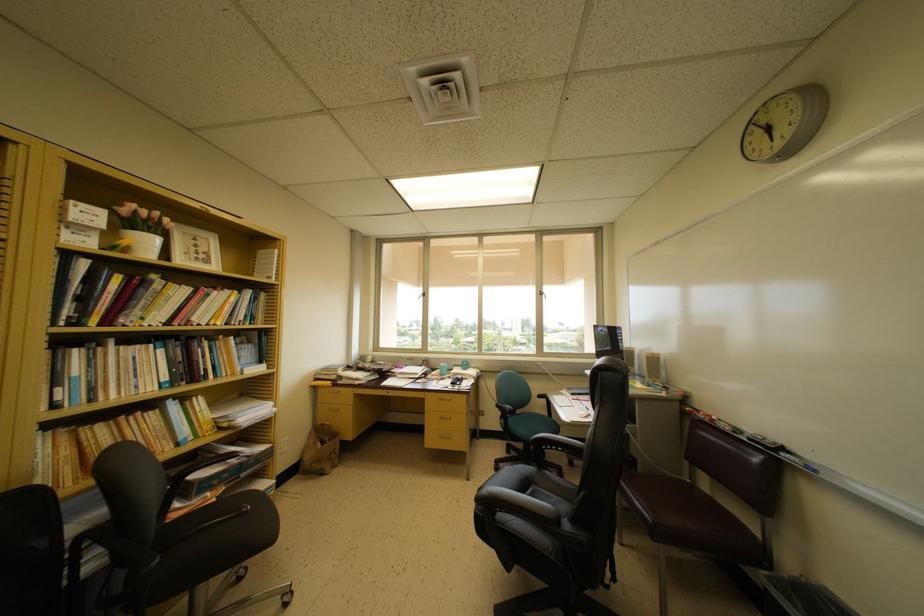
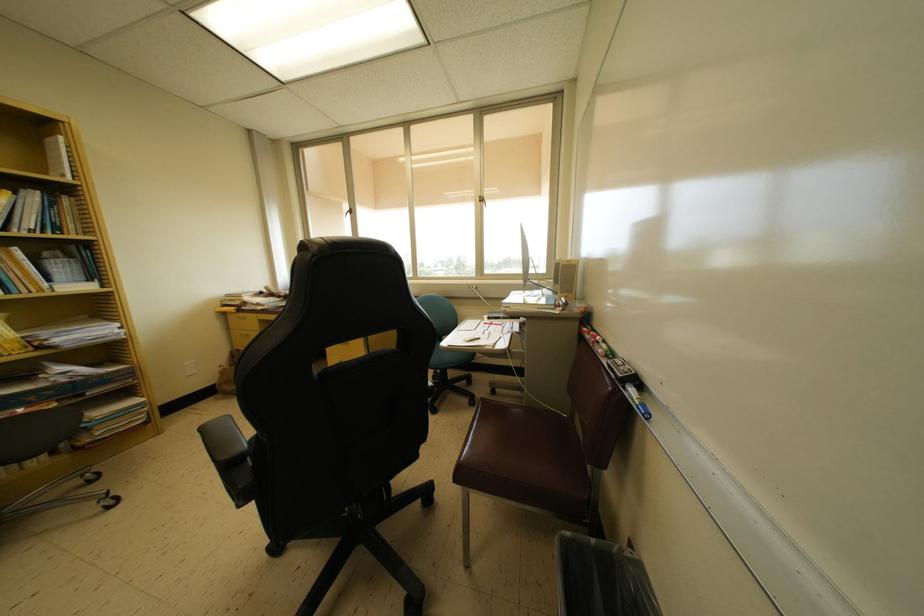
Locate, in the second image, the point that corresponds to point (281, 256) in the first image.

(65, 143)